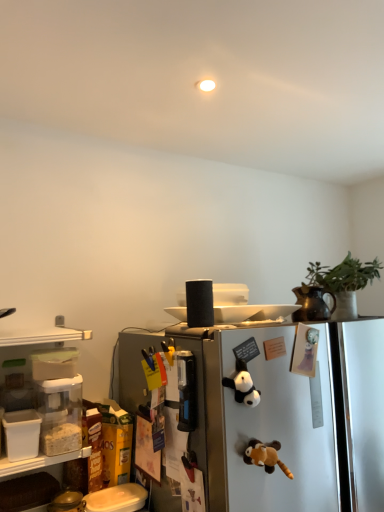
Question: Could you tell me if green matte plant at upper right is turned towards black plush panda at center, the 2th toy when ordered from bottom to top?

Choices:
 (A) yes
 (B) no

Answer: (B)

Question: From a real-world perspective, is green matte plant at upper right below black plush panda at center, positioned as the first toy in top-to-bottom order?

Choices:
 (A) no
 (B) yes

Answer: (A)

Question: Does green matte plant at upper right lie behind black plush panda at center, positioned as the first toy in top-to-bottom order?

Choices:
 (A) no
 (B) yes

Answer: (B)

Question: From the image's perspective, is green matte plant at upper right on top of black plush panda at center, positioned as the first toy in top-to-bottom order?

Choices:
 (A) no
 (B) yes

Answer: (B)

Question: Is green matte plant at upper right not within black plush panda at center, the 2th toy when ordered from bottom to top?

Choices:
 (A) no
 (B) yes

Answer: (B)

Question: From a real-world perspective, is green matte plant at upper right physically located above or below black plush panda at center, positioned as the first toy in top-to-bottom order?

Choices:
 (A) above
 (B) below

Answer: (A)

Question: From the image's perspective, relative to black plush panda at center, the 2th toy when ordered from bottom to top, is green matte plant at upper right above or below?

Choices:
 (A) above
 (B) below

Answer: (A)

Question: Based on their sizes in the image, would you say green matte plant at upper right is bigger or smaller than black plush panda at center, positioned as the first toy in top-to-bottom order?

Choices:
 (A) small
 (B) big

Answer: (B)

Question: Is green matte plant at upper right in front of or behind black plush panda at center, positioned as the first toy in top-to-bottom order, in the image?

Choices:
 (A) front
 (B) behind

Answer: (B)

Question: From the image's perspective, relative to satin silver refrigerator at center, is black plush panda at center, the 2th toy when ordered from bottom to top, above or below?

Choices:
 (A) above
 (B) below

Answer: (A)

Question: From their relative heights in the image, would you say black plush panda at center, positioned as the first toy in top-to-bottom order, is taller or shorter than satin silver refrigerator at center?

Choices:
 (A) tall
 (B) short

Answer: (B)

Question: From a real-world perspective, is black plush panda at center, the 2th toy when ordered from bottom to top, physically located above or below satin silver refrigerator at center?

Choices:
 (A) below
 (B) above

Answer: (B)

Question: Is black plush panda at center, positioned as the first toy in top-to-bottom order, wider or thinner than satin silver refrigerator at center?

Choices:
 (A) wide
 (B) thin

Answer: (B)

Question: Would you say satin silver refrigerator at center is to the left or to the right of green matte plant at upper right in the picture?

Choices:
 (A) left
 (B) right

Answer: (A)

Question: Would you say satin silver refrigerator at center is inside or outside green matte plant at upper right?

Choices:
 (A) outside
 (B) inside

Answer: (A)